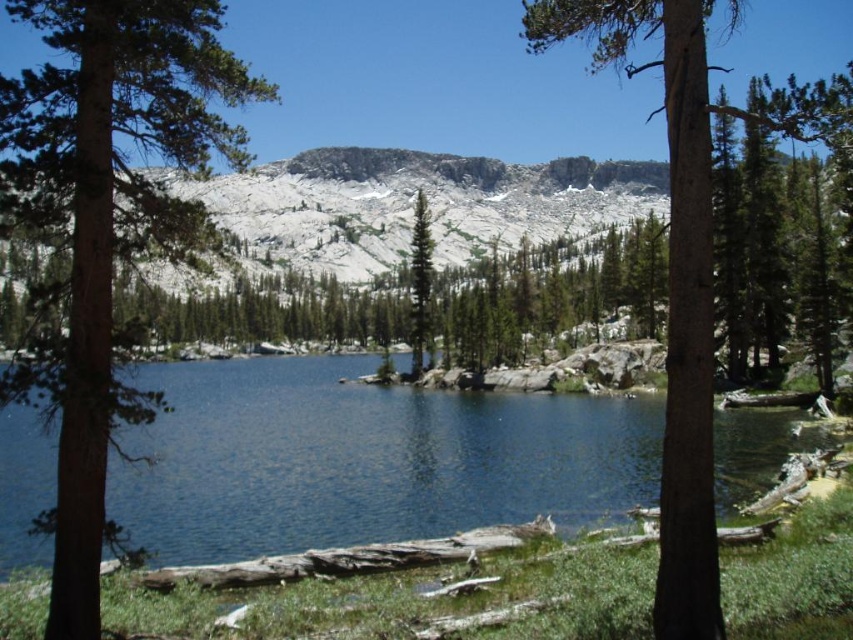
Question: Can you confirm if deep blue water at center is positioned to the left of brown rough bark tree at center?

Choices:
 (A) no
 (B) yes

Answer: (B)

Question: Which object is farther from the camera taking this photo?

Choices:
 (A) green textured pine tree at center
 (B) green matte tree at left
 (C) deep blue water at center

Answer: (A)

Question: Does deep blue water at center appear over green textured pine tree at center?

Choices:
 (A) yes
 (B) no

Answer: (B)

Question: Which object is closer to the camera taking this photo?

Choices:
 (A) green textured pine tree at center
 (B) green matte tree at left
 (C) deep blue water at center
 (D) brown rough bark tree at center

Answer: (D)

Question: Does deep blue water at center have a greater width compared to brown rough bark tree at center?

Choices:
 (A) no
 (B) yes

Answer: (A)

Question: Among these points, which one is farthest from the camera?

Choices:
 (A) (213, 484)
 (B) (428, 344)

Answer: (B)